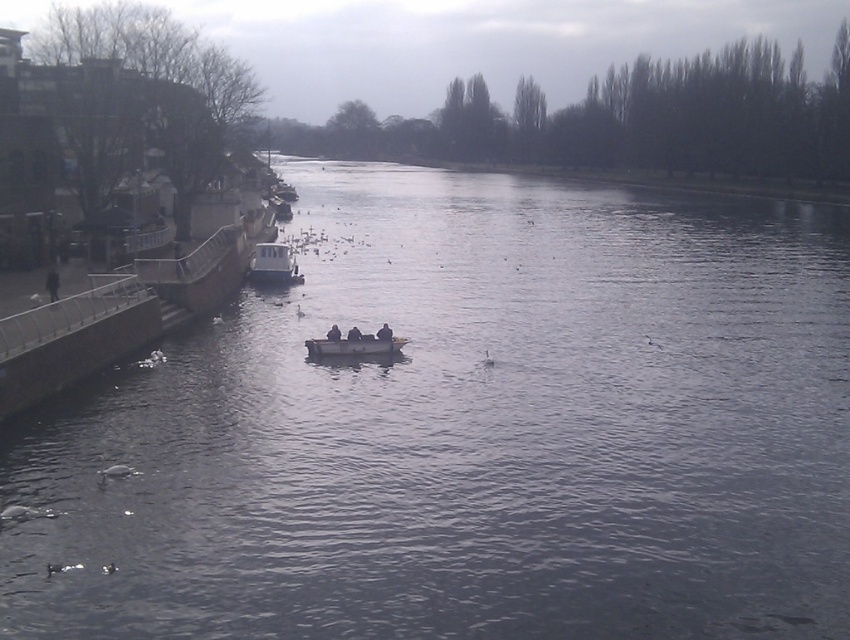
Question: Is smooth wooden boat at center wider than gray matte duck at lower left?

Choices:
 (A) no
 (B) yes

Answer: (B)

Question: Estimate the real-world distances between objects in this image. Which object is closer to the dark brown wooden boat at center?

Choices:
 (A) dark gray fabric jacket at center
 (B) white matte duck at lower left
 (C) white fluffy duck at lower left

Answer: (A)

Question: Is smooth wooden boat at center below white fluffy duck at lower left?

Choices:
 (A) yes
 (B) no

Answer: (B)

Question: Can you confirm if black matte boat at center is positioned to the left of dark gray fabric jacket at center?

Choices:
 (A) yes
 (B) no

Answer: (A)

Question: Which point is closer to the camera?

Choices:
 (A) (112, 474)
 (B) (82, 564)
 (C) (386, 324)

Answer: (B)

Question: Which object is closer to the camera taking this photo?

Choices:
 (A) black matte boat at center
 (B) dark brown wooden boat at center
 (C) white plastic boat at center
 (D) white fluffy duck at lower left

Answer: (D)